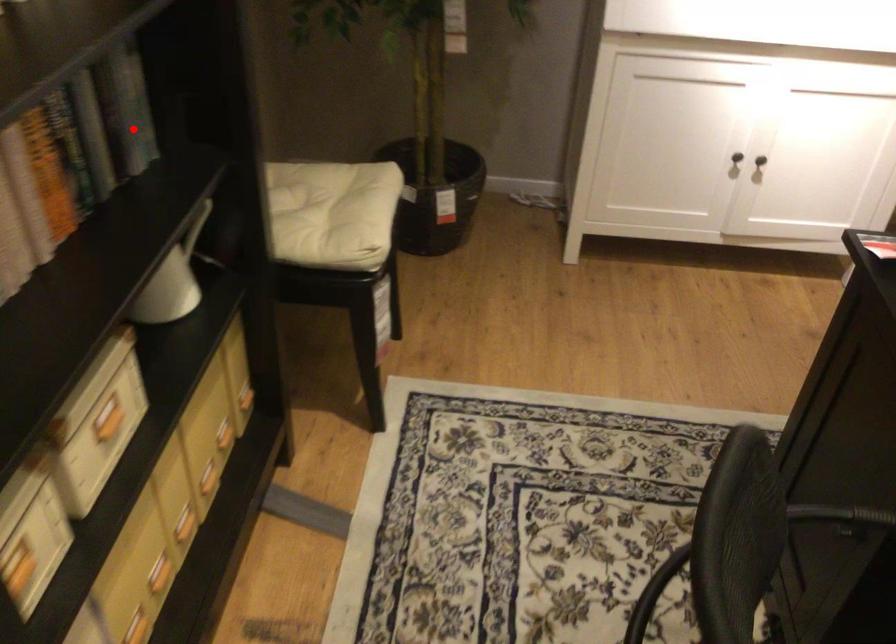
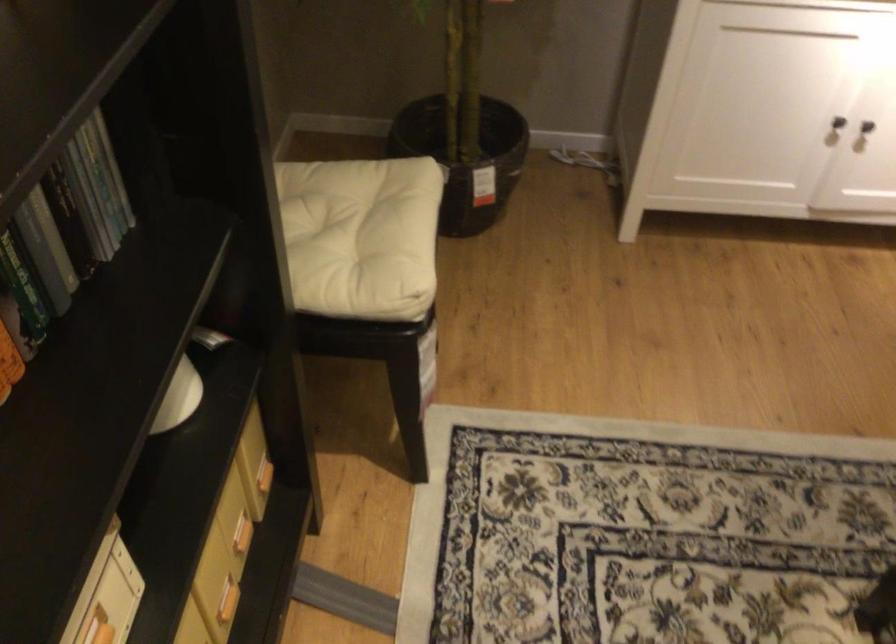
In the second image, find the point that corresponds to the highlighted location in the first image.

(95, 198)